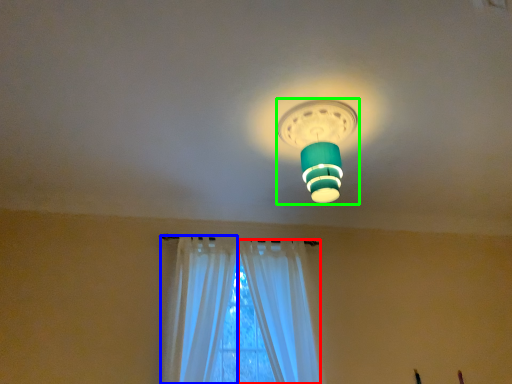
Question: Considering the real-world distances, which object is closest to curtain (highlighted by a red box)? curtain (highlighted by a blue box) or lamp (highlighted by a green box).

Choices:
 (A) curtain
 (B) lamp

Answer: (A)